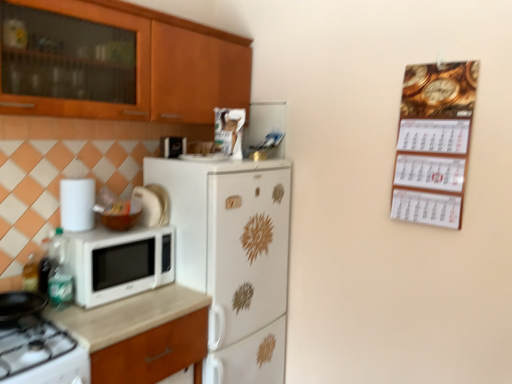
Question: Should I look upward or downward to see white matte microwave at left?

Choices:
 (A) down
 (B) up

Answer: (A)

Question: From a real-world perspective, is white matte paper towel holder at left, which appears as the 2th appliance when ordered from the bottom, positioned over white matte microwave at left based on gravity?

Choices:
 (A) no
 (B) yes

Answer: (B)

Question: Is white matte paper towel holder at left, placed as the third appliance when sorted from back to front, facing away from white matte microwave at left?

Choices:
 (A) no
 (B) yes

Answer: (A)

Question: Does white matte paper towel holder at left, placed as the third appliance when sorted from back to front, come behind white matte microwave at left?

Choices:
 (A) no
 (B) yes

Answer: (B)

Question: Is white matte paper towel holder at left, which is the 1th appliance in front-to-back order, bigger than white matte microwave at left?

Choices:
 (A) yes
 (B) no

Answer: (B)

Question: Is white matte paper towel holder at left, the first appliance in the left-to-right sequence, completely or partially outside of white matte microwave at left?

Choices:
 (A) yes
 (B) no

Answer: (A)

Question: Is white matte paper towel holder at left, which is the second appliance in top-to-bottom order, taller than white matte microwave at left?

Choices:
 (A) yes
 (B) no

Answer: (B)

Question: Is wooden cabinet at upper left in contact with white glossy gas stove at lower left?

Choices:
 (A) no
 (B) yes

Answer: (A)

Question: Does wooden cabinet at upper left have a lesser width compared to white glossy gas stove at lower left?

Choices:
 (A) no
 (B) yes

Answer: (B)

Question: Can you confirm if wooden cabinet at upper left is taller than white glossy gas stove at lower left?

Choices:
 (A) no
 (B) yes

Answer: (B)

Question: Is wooden cabinet at upper left shorter than white glossy gas stove at lower left?

Choices:
 (A) yes
 (B) no

Answer: (B)

Question: Does wooden cabinet at upper left lie in front of white glossy gas stove at lower left?

Choices:
 (A) yes
 (B) no

Answer: (B)

Question: Does wooden cabinet at upper left come behind white glossy gas stove at lower left?

Choices:
 (A) no
 (B) yes

Answer: (B)

Question: Is white matte microwave at left completely or partially outside of white glossy refrigerator at center?

Choices:
 (A) yes
 (B) no

Answer: (A)